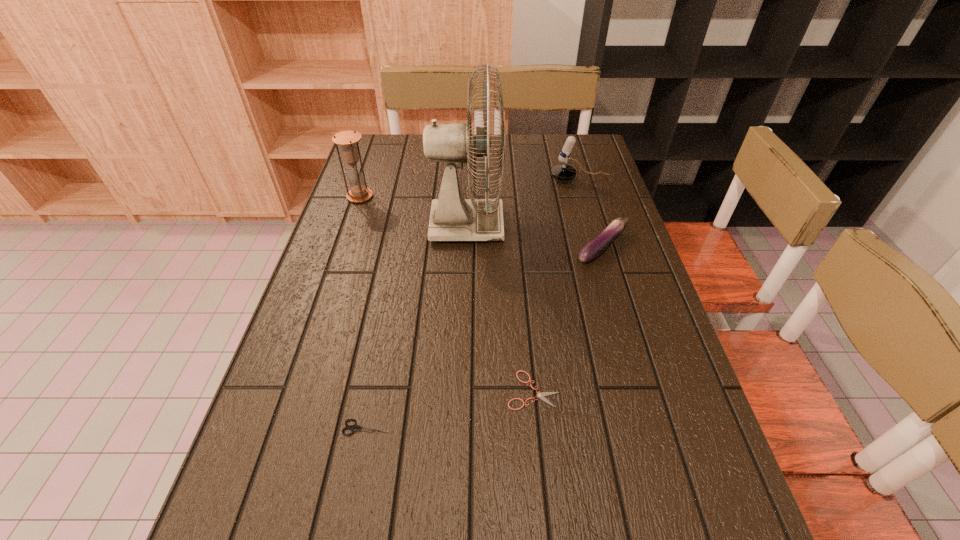
You are a GUI agent. You are given a task and a screenshot of the screen. Output one action in this format:
    pyautogui.click(x=<x>, y=<y>)
    Task: Click on the vacant area at the left edge
    
    Given the screenshot: What is the action you would take?
    pyautogui.click(x=379, y=238)

In the image, there is a desktop. Identify the location of vacant space at the right edge. (676, 366).

In the image, there is a desktop. Identify the location of vacant space at the far left corner. Image resolution: width=960 pixels, height=540 pixels. (406, 152).

Find the location of a particular element. vacant space at the far right corner of the desktop is located at coordinates (564, 136).

Locate an element on the screen. free space between the shortest object and the fan is located at coordinates (500, 308).

Identify the location of unoccupied position between the farthest object and the right shears. The width and height of the screenshot is (960, 540). (557, 285).

Where is `free space between the farthest object and the shortest object`? free space between the farthest object and the shortest object is located at coordinates (557, 285).

You are a GUI agent. You are given a task and a screenshot of the screen. Output one action in this format:
    pyautogui.click(x=<x>, y=<y>)
    Task: Click on the vacant area that lies between the nearer shears and the eggplant
    The image size is (960, 540).
    Given the screenshot: What is the action you would take?
    pyautogui.click(x=485, y=338)

Where is `vacant area that lies between the eggplant and the tallest object`? The height and width of the screenshot is (540, 960). vacant area that lies between the eggplant and the tallest object is located at coordinates (535, 237).

Where is `free point between the third shortest object and the fan`? This screenshot has height=540, width=960. free point between the third shortest object and the fan is located at coordinates (535, 237).